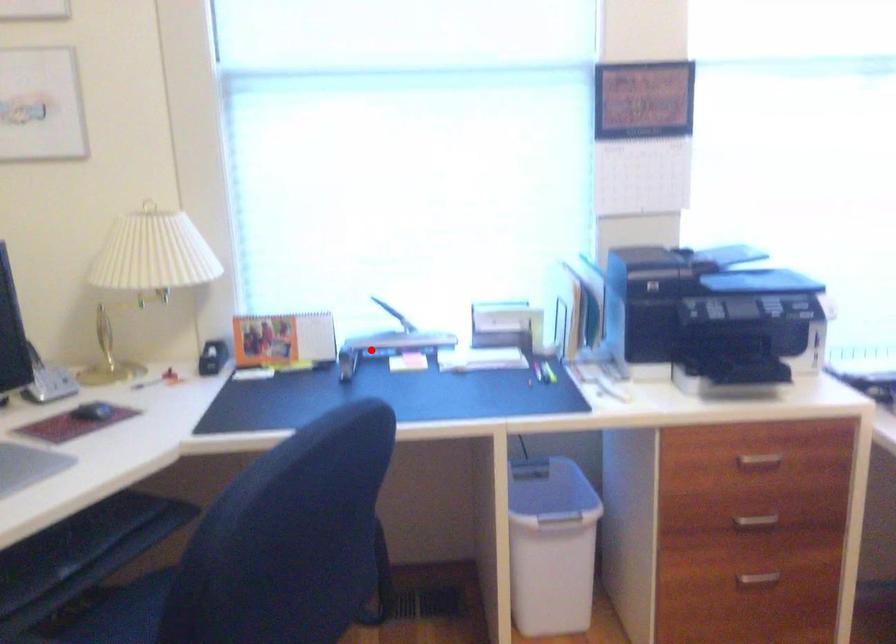
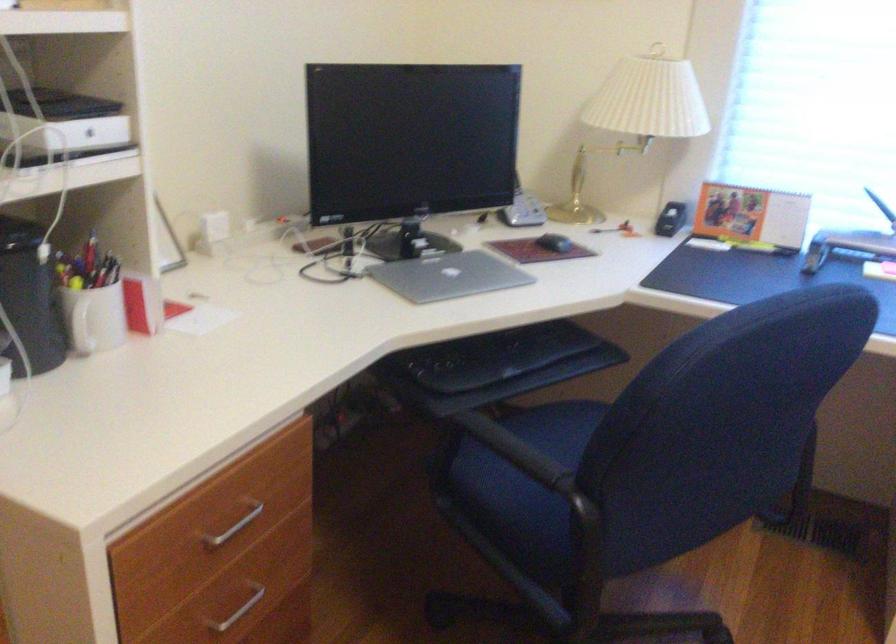
Find the pixel in the second image that matches the highlighted location in the first image.

(847, 245)